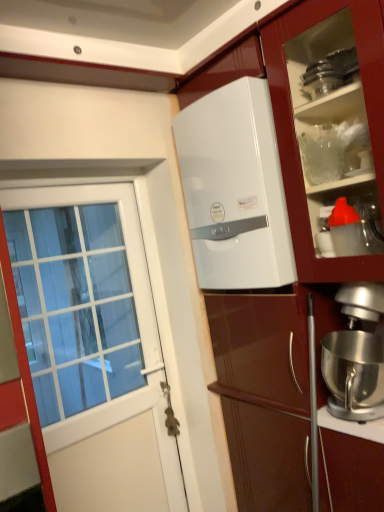
Question: Do you think silver metallic stand mixer at lower right is within white glossy water heater at upper center, or outside of it?

Choices:
 (A) inside
 (B) outside

Answer: (B)

Question: Considering the positions of silver metallic stand mixer at lower right and white glossy water heater at upper center in the image, is silver metallic stand mixer at lower right wider or thinner than white glossy water heater at upper center?

Choices:
 (A) wide
 (B) thin

Answer: (A)

Question: Considering the real-world distances, which object is farthest from the white glossy door at left?

Choices:
 (A) silver metallic stand mixer at lower right
 (B) white glossy refrigerator at center
 (C) white glossy water heater at upper center
 (D) metallic silver door handle at lower center

Answer: (A)

Question: Considering the real-world distances, which object is farthest from the metallic silver door handle at lower center?

Choices:
 (A) white glossy refrigerator at center
 (B) white glossy water heater at upper center
 (C) white glossy door at left
 (D) silver metallic stand mixer at lower right

Answer: (B)